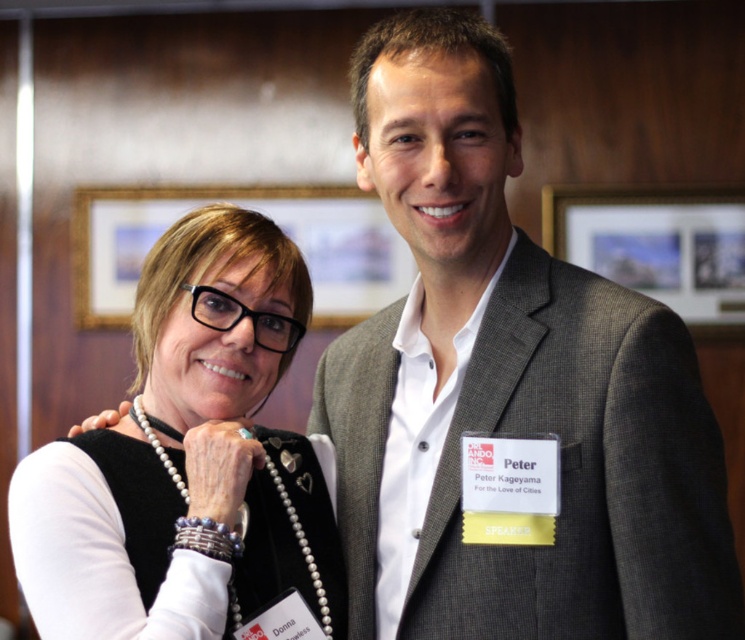
Question: Which object appears closest to the camera in this image?

Choices:
 (A) gray wool suit at center
 (B) pearl necklace at center

Answer: (B)

Question: Which point is farther to the camera?

Choices:
 (A) gray wool suit at center
 (B) pearl necklace at center

Answer: (A)

Question: Where is gray wool suit at center located in relation to pearl necklace at center in the image?

Choices:
 (A) right
 (B) left

Answer: (A)

Question: Is gray wool suit at center below pearl necklace at center?

Choices:
 (A) no
 (B) yes

Answer: (A)

Question: From the image, what is the correct spatial relationship of gray wool suit at center in relation to pearl necklace at center?

Choices:
 (A) below
 (B) above

Answer: (B)